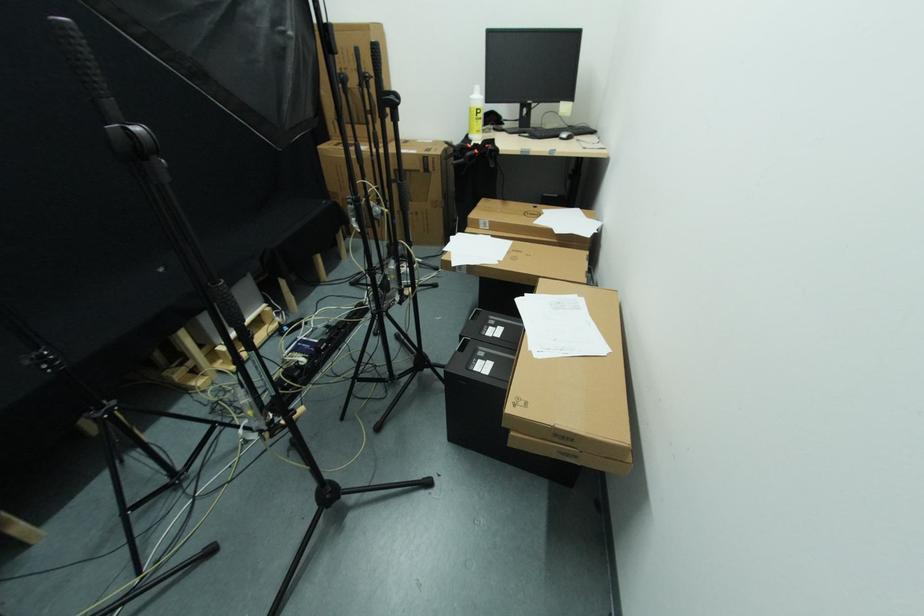
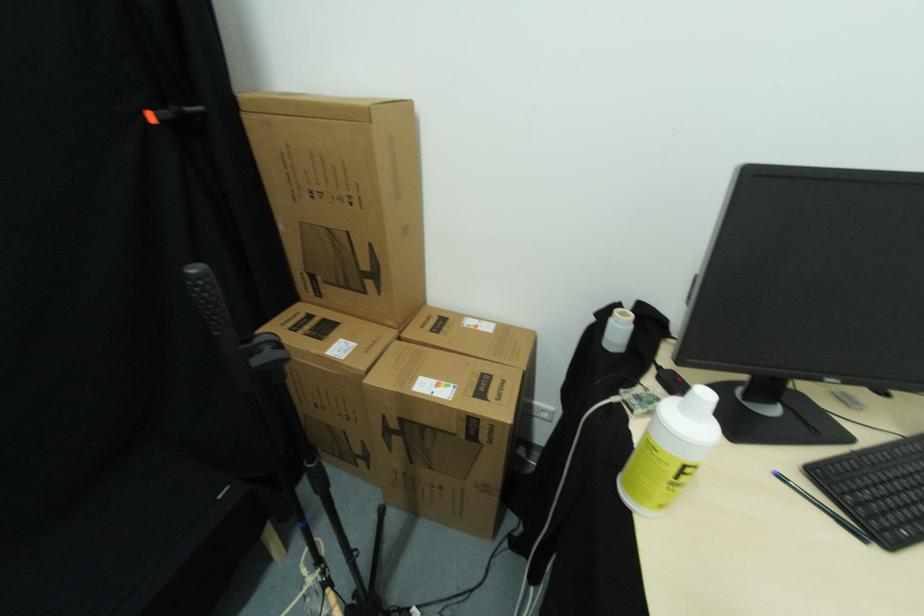
In the second image, find the point that corresponds to pixel 479 119 in the first image.

(678, 480)